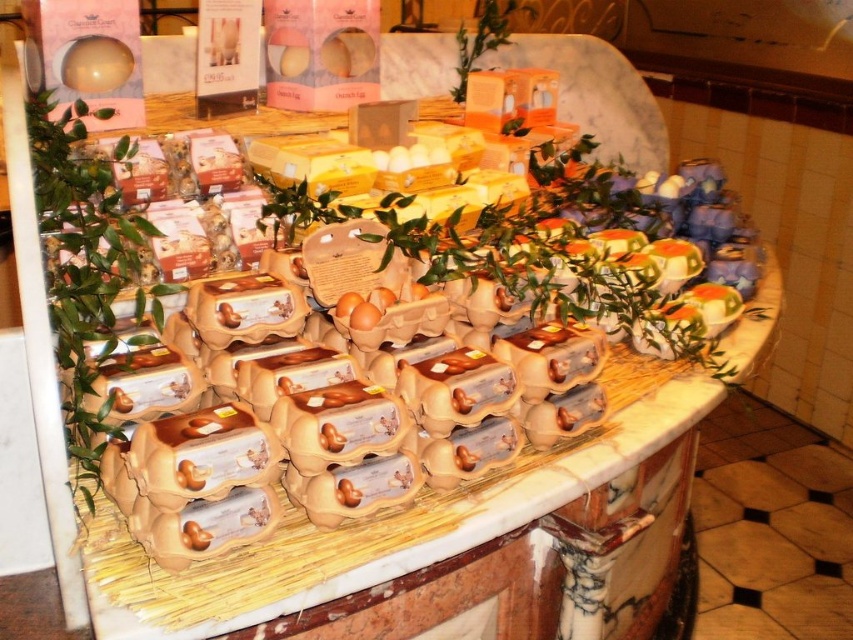
Question: Among these points, which one is farthest from the camera?

Choices:
 (A) (106, 342)
 (B) (465, 74)

Answer: (B)

Question: Among these objects, which one is farthest from the camera?

Choices:
 (A) green leafy plant at left
 (B) green leafy plant at upper center

Answer: (B)

Question: In this image, where is green leafy plant at left located relative to green leafy plant at upper center?

Choices:
 (A) right
 (B) left

Answer: (B)

Question: Among these points, which one is nearest to the camera?

Choices:
 (A) (138, 228)
 (B) (461, 60)

Answer: (A)

Question: Is green leafy plant at left positioned before green leafy plant at upper center?

Choices:
 (A) no
 (B) yes

Answer: (B)

Question: From the image, what is the correct spatial relationship of green leafy plant at left in relation to green leafy plant at upper center?

Choices:
 (A) right
 (B) left

Answer: (B)